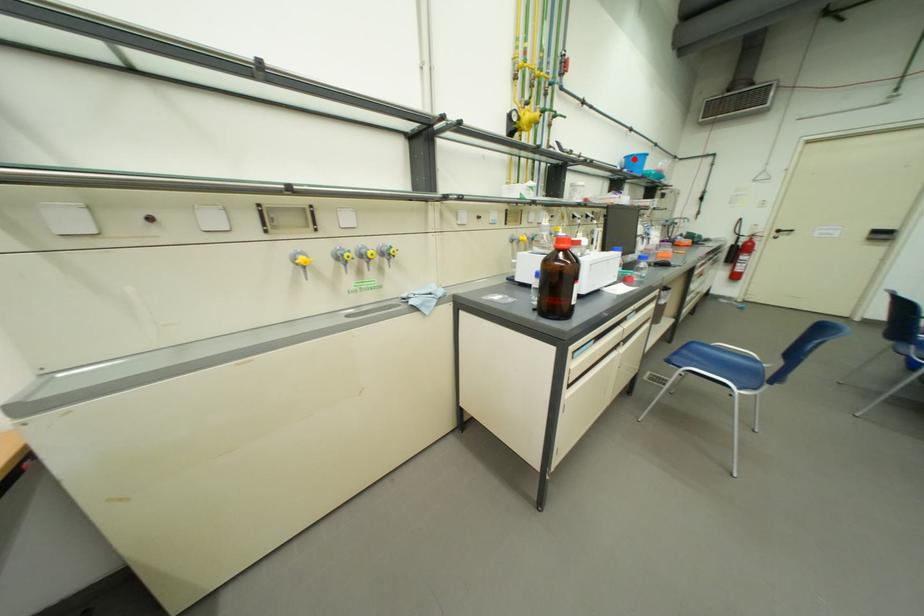
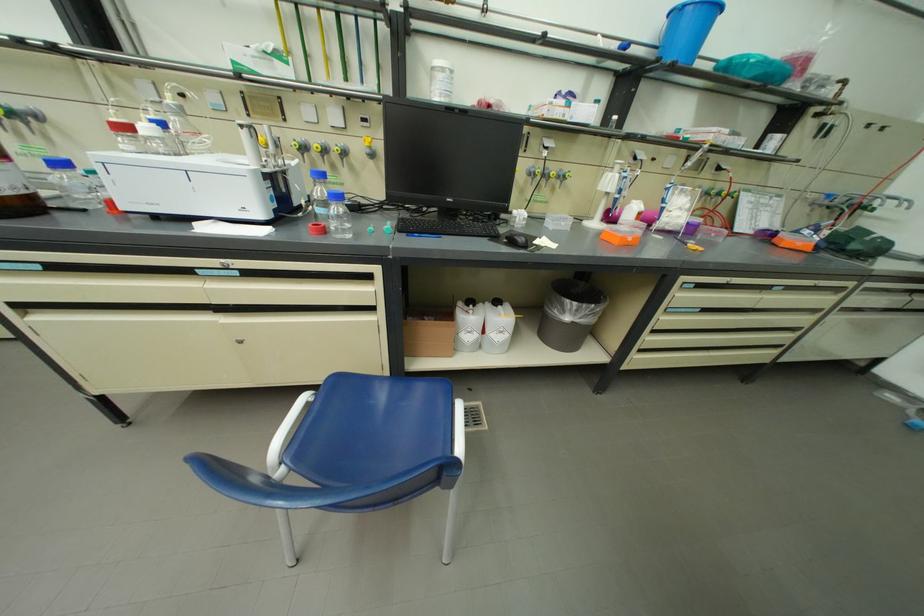
Question: I am providing you with two images of the same scene from different viewpoints. Image1 has a red point marked. In image2, the corresponding 3D location appears at what relative position? Reply with the corresponding letter.

Choices:
 (A) Closer
 (B) Farther

Answer: (B)